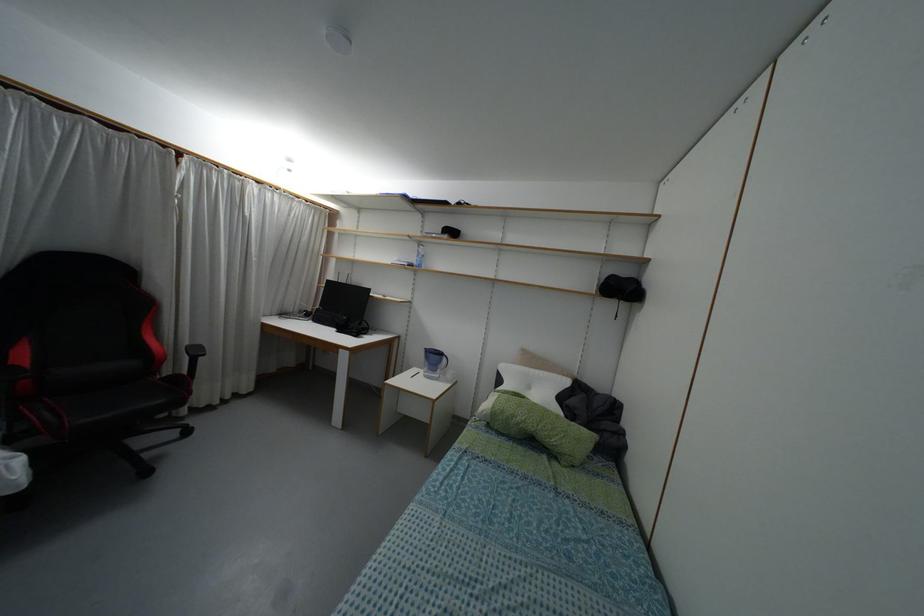
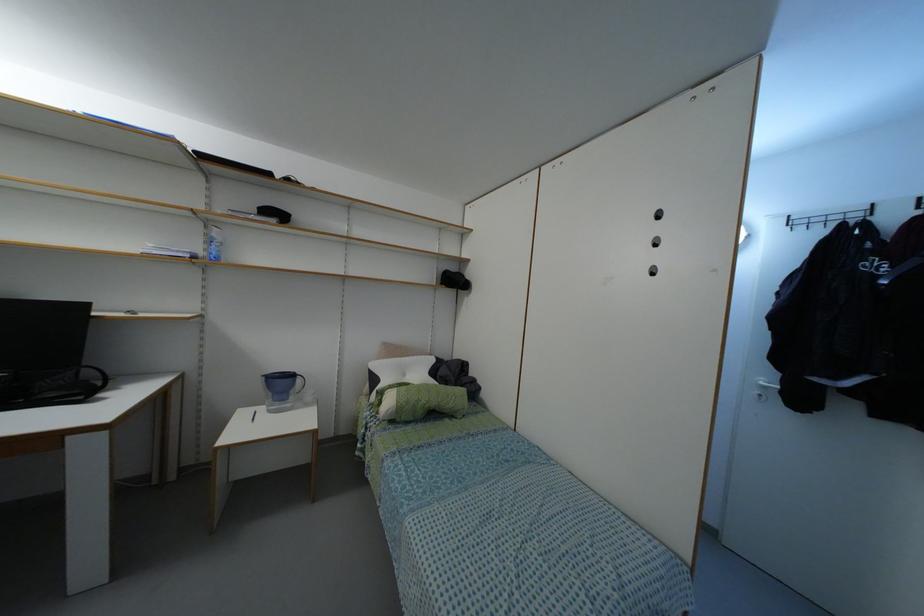
The point at (419, 265) is marked in the first image. Where is the corresponding point in the second image?

(216, 257)